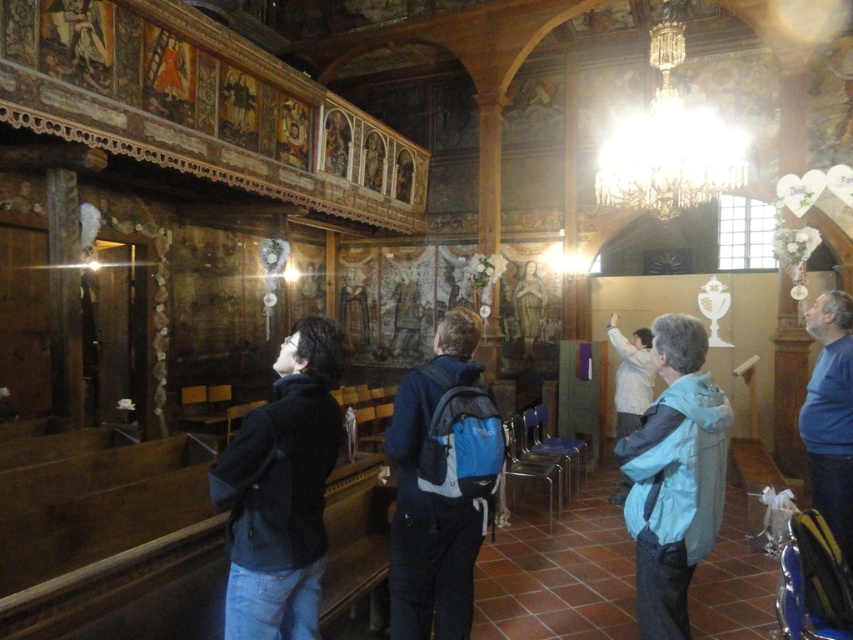
You are standing in the church and want to take a photo. You notice two points in the scene labeled as point 1 at coordinates point 1 at coordinates point (293, 547) and point 2 at coordinates point (723, 493). Which point will appear larger in your photo?

Point 1 at coordinates point (293, 547) will appear larger in the photo because it is closer to the camera than point 2 at coordinates point (723, 493).

You are a visitor to this church and you see the black soft jacket at center and the light blue fabric jacket at lower right. Which jacket is wider?

The black soft jacket at center is wider than the light blue fabric jacket at lower right.